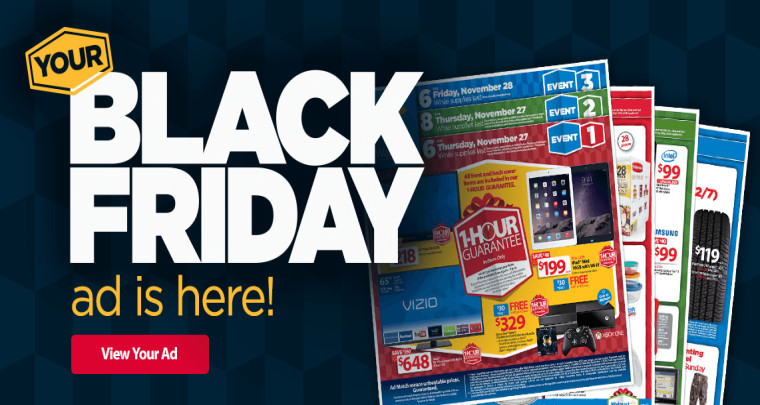
Locate an element on the screen. This screenshot has height=405, width=760. game console is located at coordinates (578, 315), (580, 342).